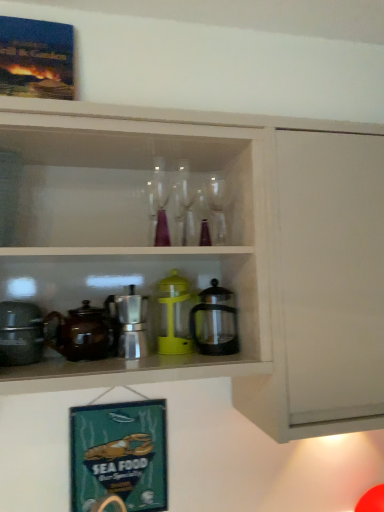
Question: From the image's perspective, relative to clear glass wine glass at center, which is counted as the 2th wine glass, starting from the right, is green fabric signboard at lower left, placed as the first picture frame when sorted from back to front, above or below?

Choices:
 (A) below
 (B) above

Answer: (A)

Question: From a real-world perspective, relative to clear glass wine glass at center, which is counted as the 2th wine glass, starting from the right, is green fabric signboard at lower left, positioned as the second picture frame in top-to-bottom order, vertically above or below?

Choices:
 (A) below
 (B) above

Answer: (A)

Question: Estimate the real-world distances between objects in this image. Which object is farther from the wooden picture frame at upper left, which is counted as the 2th picture frame, starting from the bottom?

Choices:
 (A) yellow plastic container at center, which is the 2th appliance from left to right
 (B) clear glass wine glass at center, which ranks as the 2th wine glass in left-to-right order
 (C) metallic silver coffee pot at center, which is the 1th coffeepot in left-to-right order
 (D) matte white cabinet at upper center
 (E) clear glass wine glass at center, which is counted as the 2th wine glass, starting from the right

Answer: (A)

Question: Which object is positioned farthest from the matte black pot at left, positioned as the first appliance in left-to-right order?

Choices:
 (A) transparent glass coffee pot at center, which is counted as the 2th coffeepot, starting from the left
 (B) yellow plastic container at center, which is the 2th appliance from left to right
 (C) wooden picture frame at upper left, which is the second picture frame in back-to-front order
 (D) green fabric signboard at lower left, the second picture frame positioned from the front
 (E) metallic silver coffee pot at center, which is the 1th coffeepot in left-to-right order

Answer: (C)